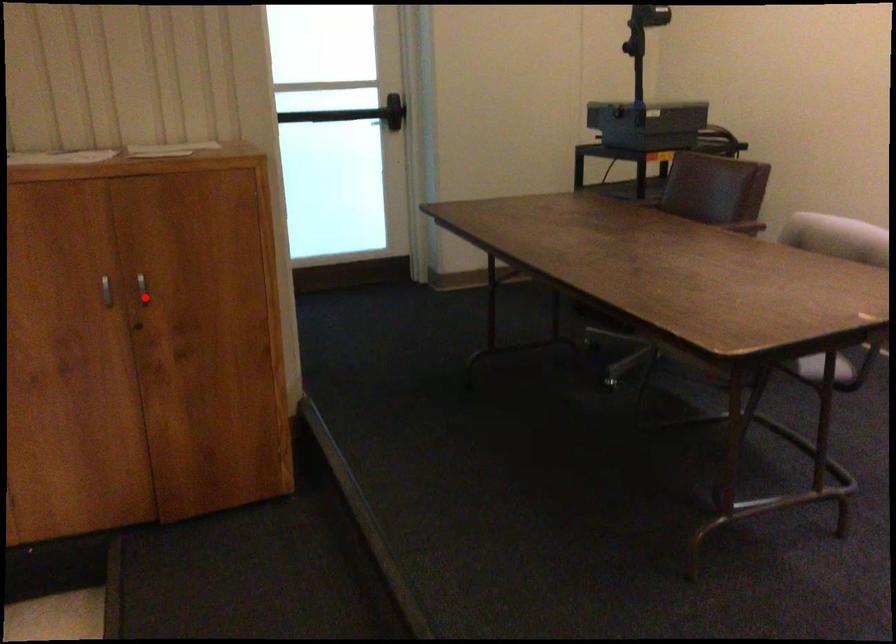
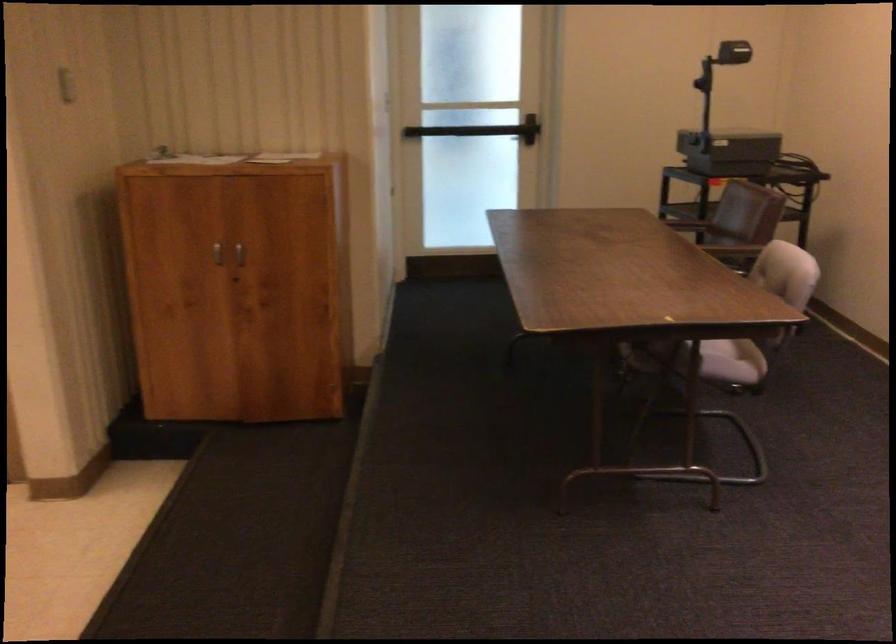
Question: I am providing you with two images of the same scene from different viewpoints. Image1 has a red point marked. In image2, the corresponding 3D location appears at what relative position? Reply with the corresponding letter.

Choices:
 (A) Closer
 (B) Farther

Answer: (B)